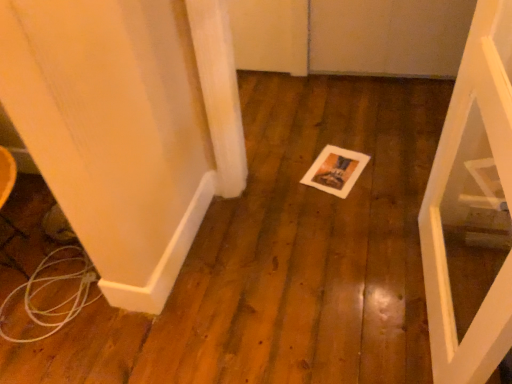
Question: From a real-world perspective, is white matte door at center physically below white paper at center?

Choices:
 (A) no
 (B) yes

Answer: (A)

Question: Is white matte door at center far away from white paper at center?

Choices:
 (A) no
 (B) yes

Answer: (A)

Question: Is white matte door at center positioned before white paper at center?

Choices:
 (A) no
 (B) yes

Answer: (B)

Question: Is white matte door at center to the right of white paper at center from the viewer's perspective?

Choices:
 (A) yes
 (B) no

Answer: (A)

Question: Is white matte door at center turned away from white paper at center?

Choices:
 (A) no
 (B) yes

Answer: (A)

Question: Is white matte door at center wider than white paper at center?

Choices:
 (A) no
 (B) yes

Answer: (A)

Question: From a real-world perspective, is white paper at center positioned under white matte door at center based on gravity?

Choices:
 (A) yes
 (B) no

Answer: (A)

Question: Is white paper at center positioned beyond the bounds of white matte door at center?

Choices:
 (A) yes
 (B) no

Answer: (A)

Question: Does white paper at center touch white matte door at center?

Choices:
 (A) yes
 (B) no

Answer: (B)

Question: Is white paper at center facing towards white matte door at center?

Choices:
 (A) no
 (B) yes

Answer: (A)

Question: Is white paper at center further to camera compared to white matte door at center?

Choices:
 (A) yes
 (B) no

Answer: (A)

Question: Can you confirm if white paper at center is thinner than white matte door at center?

Choices:
 (A) no
 (B) yes

Answer: (A)

Question: Considering the relative positions of white paper at center and white matte door at center in the image provided, is white paper at center to the left or to the right of white matte door at center?

Choices:
 (A) right
 (B) left

Answer: (B)